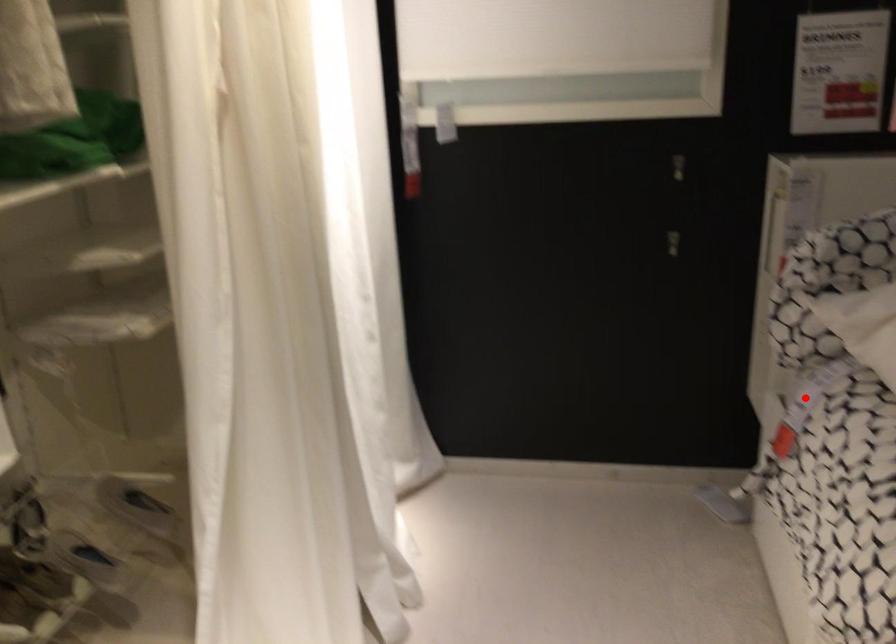
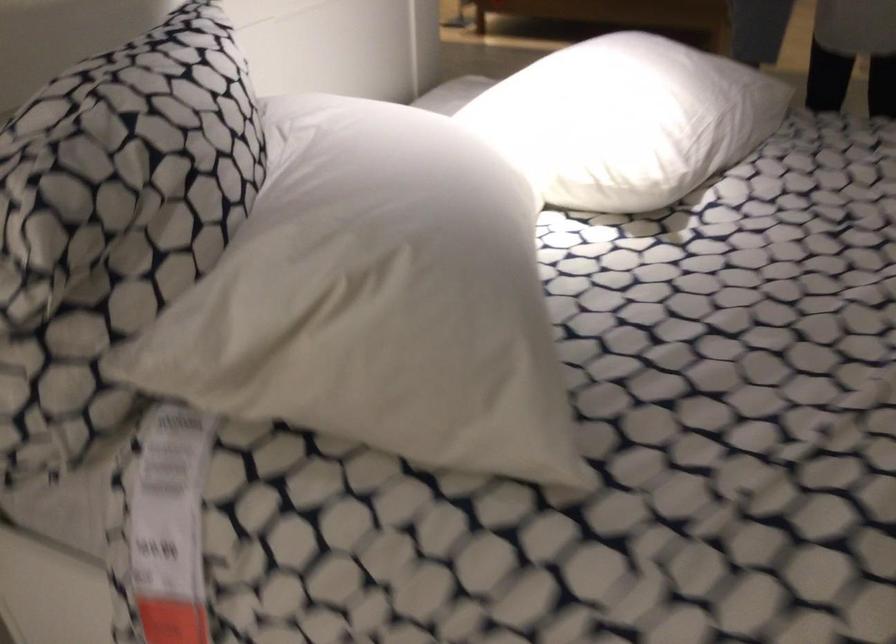
Locate, in the second image, the point that corresponds to the highlighted location in the first image.

(169, 526)